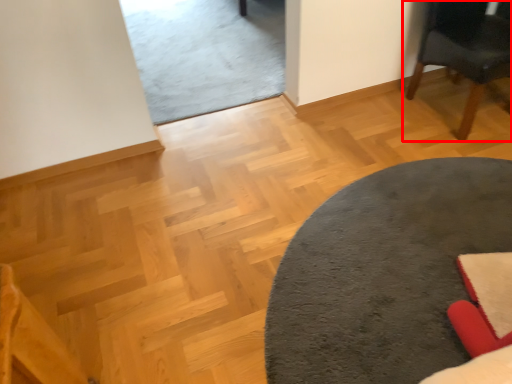
Question: Observing the image, what is the correct spatial positioning of chair (annotated by the red box) in reference to table?

Choices:
 (A) left
 (B) right

Answer: (B)